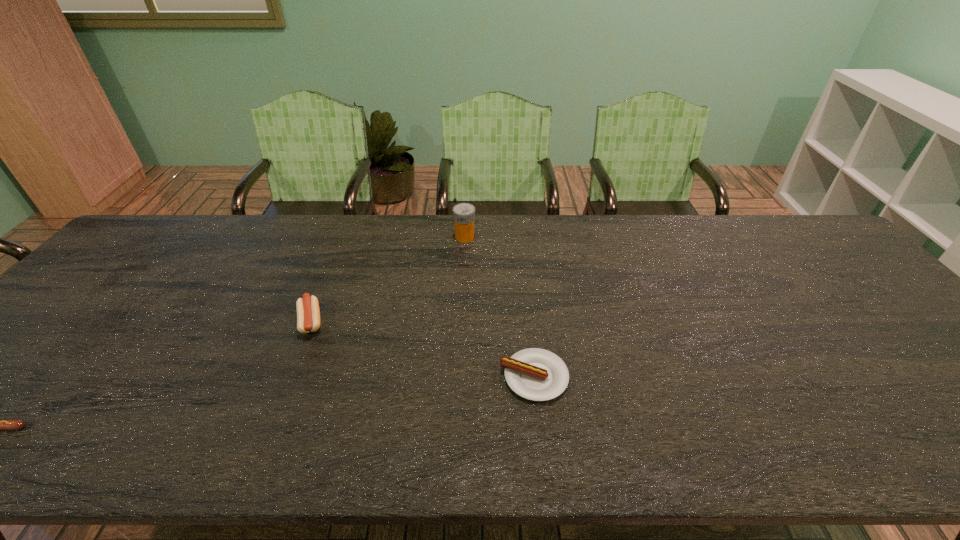
The image size is (960, 540). What are the coordinates of `free point between the farthest sausage and the second object from right to left` in the screenshot? It's located at (388, 279).

You are a GUI agent. You are given a task and a screenshot of the screen. Output one action in this format:
    pyautogui.click(x=<x>, y=<y>)
    Task: Click on the unoccupied position between the medicine and the tallest sausage
    This screenshot has width=960, height=540.
    Given the screenshot: What is the action you would take?
    pyautogui.click(x=388, y=279)

The height and width of the screenshot is (540, 960). I want to click on object that is the nearest to the tallest sausage, so click(463, 213).

Identify the location of object that is the closest to the farthest object. (308, 313).

Choose which sausage is the second nearest neighbor to the leftmost sausage. Please provide its 2D coordinates. Your answer should be formatted as a tuple, i.e. [(x, y)], where the tuple contains the x and y coordinates of a point satisfying the conditions above.

[(536, 374)]

The height and width of the screenshot is (540, 960). I want to click on sausage object that ranks as the closest to the rightmost sausage, so click(308, 313).

Identify the location of free location that satisfies the following two spatial constraints: 1. on the front side of the second farthest object; 2. on the left side of the rightmost sausage. This screenshot has width=960, height=540. (289, 377).

Identify the location of vacant space that satisfies the following two spatial constraints: 1. on the label side of the second object from right to left; 2. on the back side of the second nearest sausage. (459, 377).

Where is `free space in the image that satisfies the following two spatial constraints: 1. on the back side of the rightmost object; 2. on the label side of the farthest object`? This screenshot has height=540, width=960. free space in the image that satisfies the following two spatial constraints: 1. on the back side of the rightmost object; 2. on the label side of the farthest object is located at coordinates (518, 237).

The width and height of the screenshot is (960, 540). What are the coordinates of `vacant region that satisfies the following two spatial constraints: 1. on the label side of the third object from left to right; 2. on the front side of the second farthest object` in the screenshot? It's located at (461, 321).